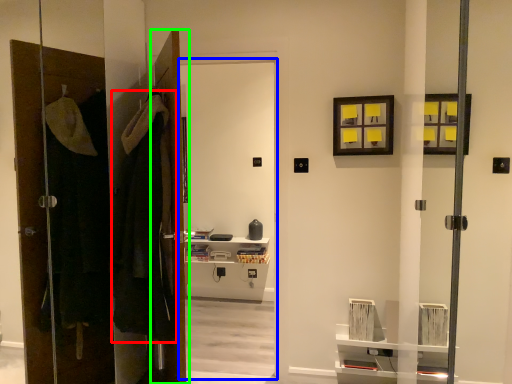
Question: Which object is the closest to the robe (highlighted by a red box)? Choose among these: screen door (highlighted by a blue box) or door (highlighted by a green box).

Choices:
 (A) screen door
 (B) door

Answer: (B)